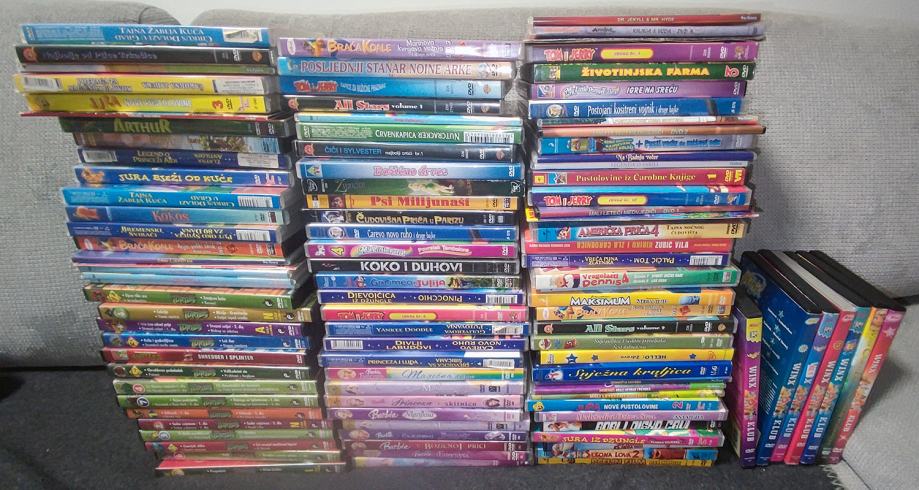
Identify the location of vertical dvd cases. Image resolution: width=919 pixels, height=490 pixels. (751, 375), (791, 371), (809, 373), (825, 375), (841, 371), (861, 357), (878, 359).